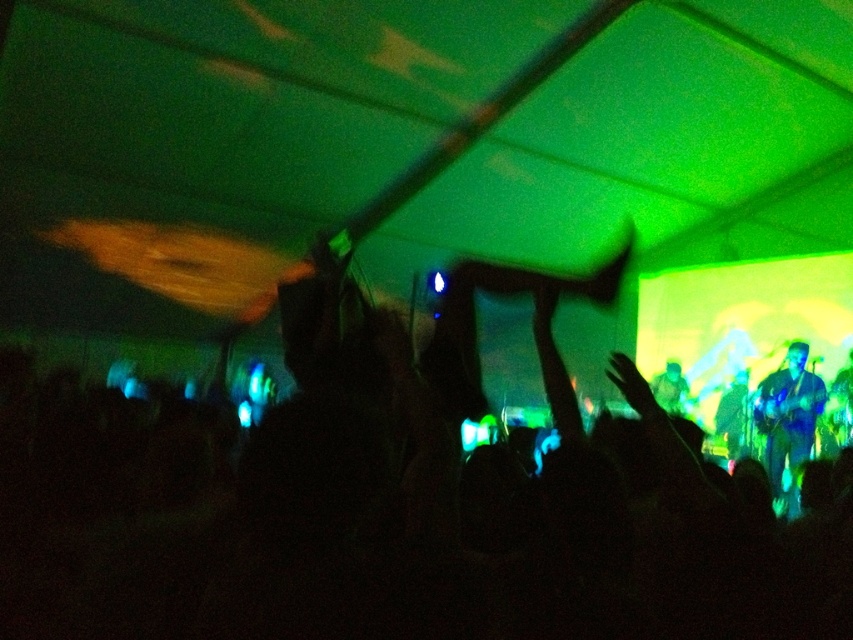
From the picture: You are standing at the center of the concert venue and want to take a photo of the silhouette of person at center. Where should you position yourself to capture their silhouette against the stage lights?

You should position yourself at point (x=397, y=502) to capture the silhouette of person at center against the stage lights.

You are a photographer standing at the front of the concert venue. You want to take a photo that includes both the silhouette of person at center and the blue metallic guitar at right. The minimum distance your camera can focus on two objects is 10 feet. Can you capture both in one shot?

The silhouette of person at center is 10.68 feet from blue metallic guitar at right. Since the minimum focusing distance is 10 feet, the camera can focus on both objects as the distance between them is just over the required minimum.

You are at the concert and want to take a photo of the stage. There are two points marked in the image. The first point, point (157, 580), is closer to the stage, and the second point, point (776, 474), is further away. If you stand at the first point, will you get a clearer photo of the stage compared to standing at the second point?

Yes, standing at point (157, 580) will provide a clearer photo of the stage because it is closer to the viewer compared to point (776, 474).